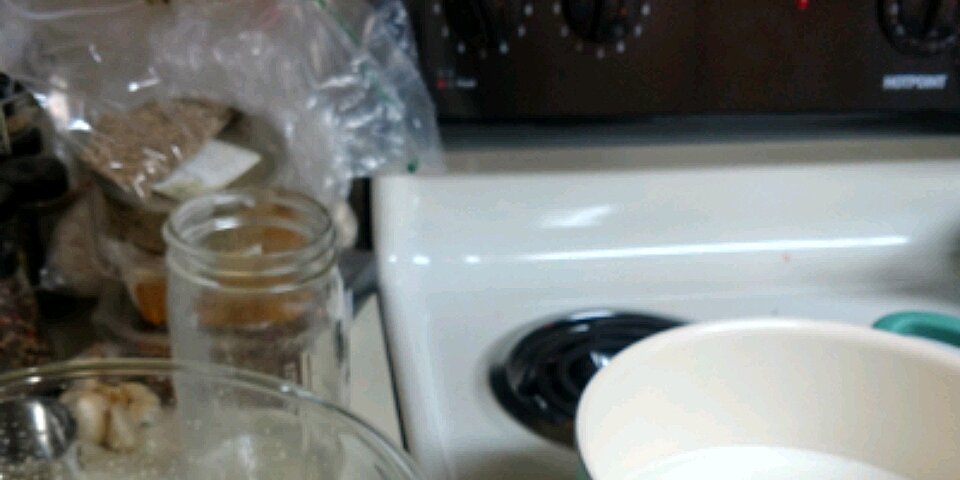
Where is `burner`? The width and height of the screenshot is (960, 480). burner is located at coordinates (543, 381).